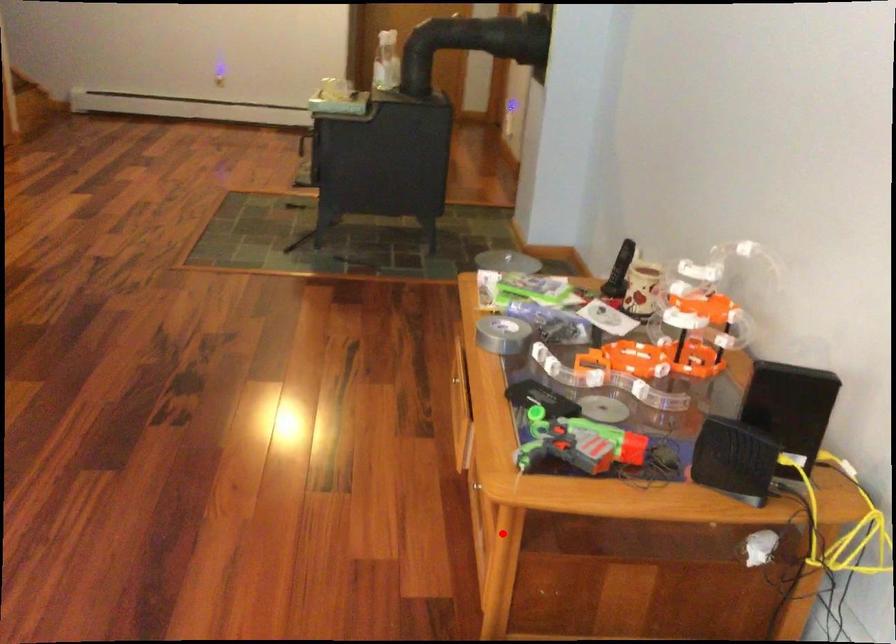
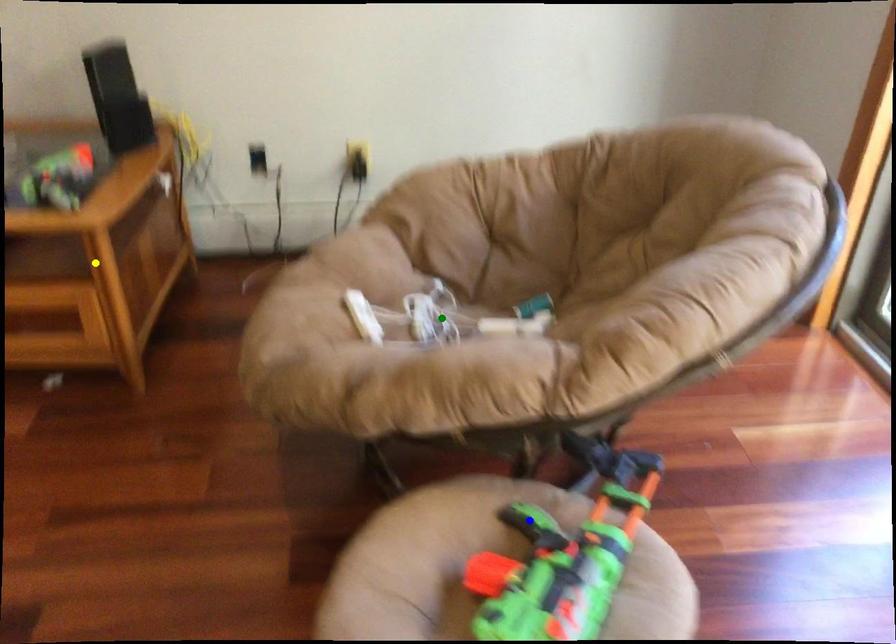
Question: I am providing you with two images of the same scene from different viewpoints. A red point is marked on the first image. You are given multiple points on the second image. In image 2, which mark is for the same physical point as the one in image 1?

Choices:
 (A) blue point
 (B) yellow point
 (C) green point

Answer: (B)